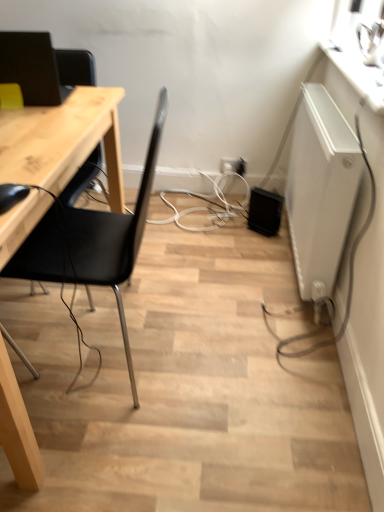
Locate an element on the screen. The image size is (384, 512). vacant space in front of black matte chair at left is located at coordinates (148, 448).